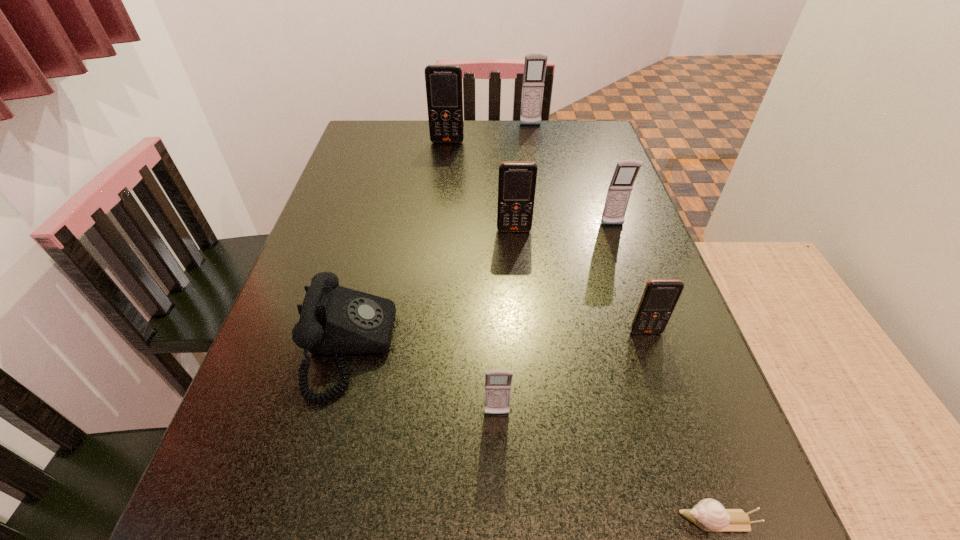
Locate which orange cellular telephone is the third closest to the escargot. Please provide its 2D coordinates. Your answer should be formatted as a tuple, i.e. [(x, y)], where the tuple contains the x and y coordinates of a point satisfying the conditions above.

[(444, 93)]

Select which orange cellular telephone appears as the closest to the nearest cellular telephone. Please provide its 2D coordinates. Your answer should be formatted as a tuple, i.e. [(x, y)], where the tuple contains the x and y coordinates of a point satisfying the conditions above.

[(660, 297)]

Find the location of a particular element. The height and width of the screenshot is (540, 960). free point that satisfies the following two spatial constraints: 1. on the front-facing side of the farthest gray cellular telephone; 2. on the dial of the second shortest object is located at coordinates (569, 347).

Where is `blank space that satisfies the following two spatial constraints: 1. on the screen of the farthest orange cellular telephone; 2. on the dial of the leftmost object`? The height and width of the screenshot is (540, 960). blank space that satisfies the following two spatial constraints: 1. on the screen of the farthest orange cellular telephone; 2. on the dial of the leftmost object is located at coordinates (425, 347).